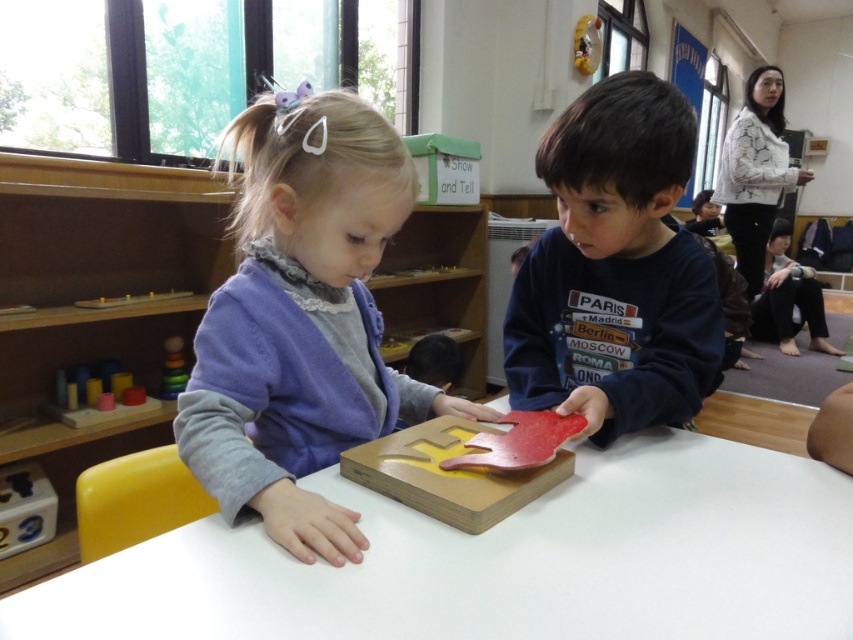
Question: Which point is farther to the camera?

Choices:
 (A) white matte table at center
 (B) matte blue shirt at center
 (C) purple matte sweater at upper left

Answer: (B)

Question: Which of the following is the closest to the observer?

Choices:
 (A) red matte wooden puzzle piece at center
 (B) white matte table at center
 (C) wooden toy at left
 (D) smooth plastic stacking rings at left

Answer: (B)

Question: Considering the relative positions of white matte table at center and matte blue shirt at center in the image provided, where is white matte table at center located with respect to matte blue shirt at center?

Choices:
 (A) below
 (B) above

Answer: (A)

Question: Which of the following is the farthest from the observer?

Choices:
 (A) pyautogui.click(x=132, y=298)
 (B) pyautogui.click(x=682, y=552)
 (C) pyautogui.click(x=198, y=328)

Answer: (A)

Question: Does red matte wooden puzzle piece at center appear over smooth plastic stacking rings at left?

Choices:
 (A) yes
 (B) no

Answer: (B)

Question: From the image, what is the correct spatial relationship of red matte wooden puzzle piece at center in relation to smooth plastic stacking rings at left?

Choices:
 (A) above
 (B) below

Answer: (B)